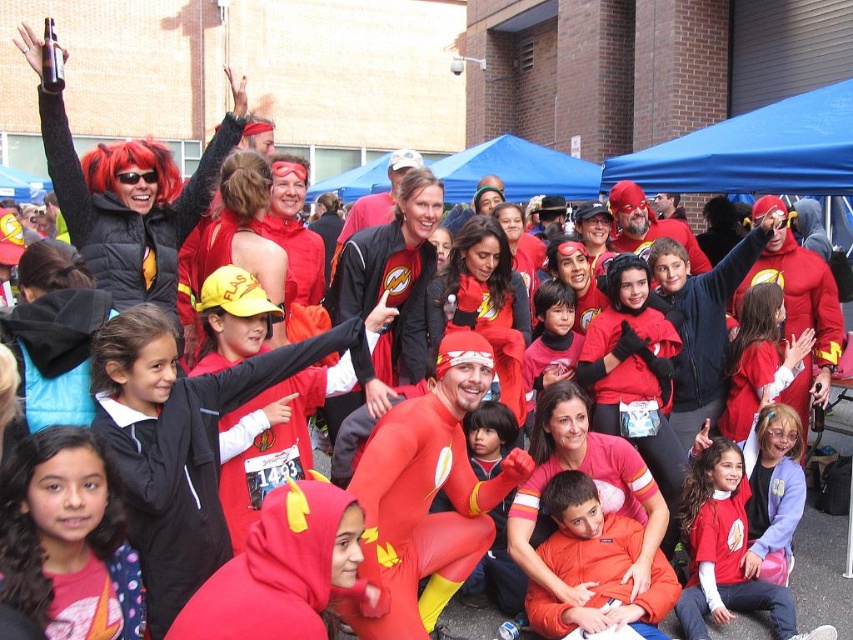
You are a photographer at the event and want to position a participant wearing the smooth red costume at center so that they are centered in the photo. However, there is a matte red shirt at lower center nearby. Based on their positions, which object is closer to the right side of the frame?

The matte red shirt at lower center is to the right of the smooth red costume at center, so the matte red shirt at lower center is closer to the right side of the frame.

You are a photographer trying to capture a clear shot of both the matte red shirt at lower center and the smooth red costume at center. Since you want to focus on the lower part of the image, which object should you adjust your camera to prioritize?

The smooth red costume at center is below the matte red shirt at lower center, so to focus on the lower part of the image, prioritize the smooth red costume at center.